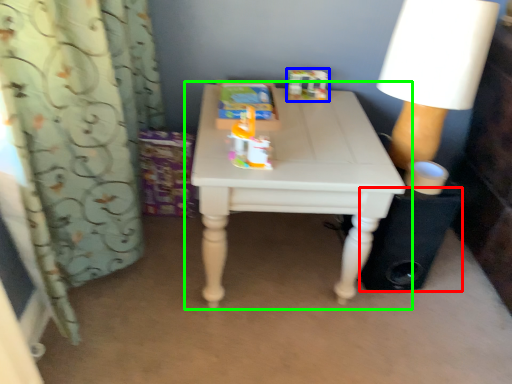
Question: Which object is positioned farthest from speaker (highlighted by a red box)? Select from toy (highlighted by a blue box) and table (highlighted by a green box).

Choices:
 (A) toy
 (B) table

Answer: (A)